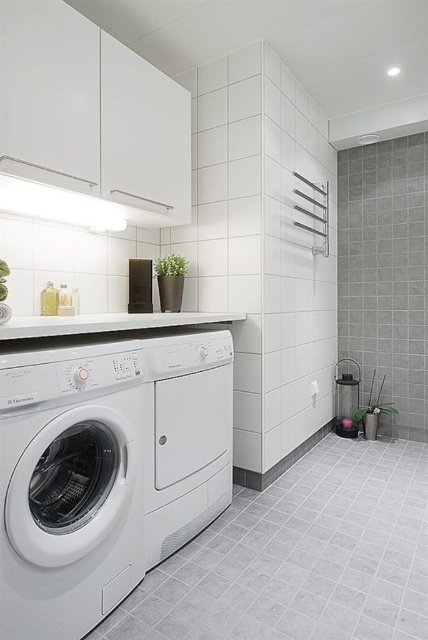
Question: Among these points, which one is farthest from the camera?

Choices:
 (A) (62, 618)
 (B) (160, 435)

Answer: (B)

Question: Which object is closer to the camera taking this photo?

Choices:
 (A) white matte washing machine at center
 (B) white matte washing machine at left

Answer: (B)

Question: Can you confirm if white matte washing machine at left is bigger than white matte washing machine at center?

Choices:
 (A) no
 (B) yes

Answer: (A)

Question: Does white matte washing machine at left appear on the left side of white matte washing machine at center?

Choices:
 (A) no
 (B) yes

Answer: (B)

Question: Observing the image, what is the correct spatial positioning of white matte washing machine at left in reference to white matte washing machine at center?

Choices:
 (A) below
 (B) above

Answer: (A)